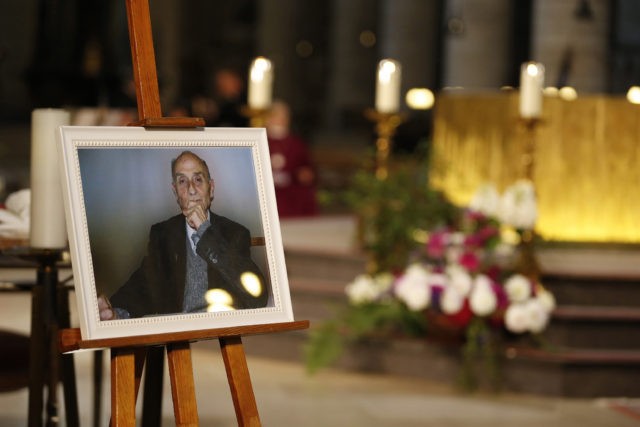
Where is `candle`? Image resolution: width=640 pixels, height=427 pixels. candle is located at coordinates (260, 90), (386, 81), (531, 84).